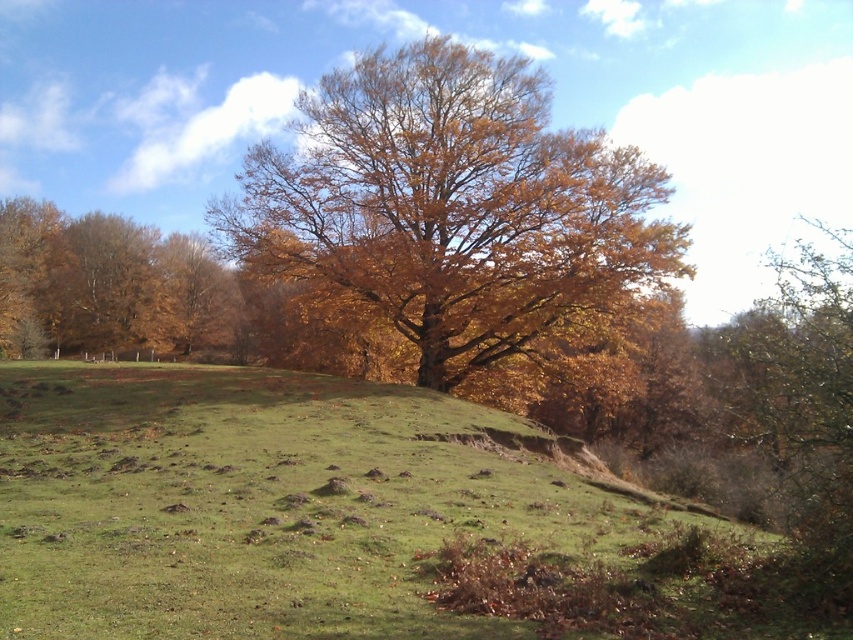
Looking at this image, between green grass at center and brown leafy tree at left, which one is positioned lower?

green grass at center is lower down.

Is green grass at center bigger than brown leafy tree at left?

Incorrect, green grass at center is not larger than brown leafy tree at left.

Who is more distant from viewer, [25,605] or [61,248]?

Answer: Positioned behind is point [61,248].

Image resolution: width=853 pixels, height=640 pixels. Identify the location of green grass at center. (265, 506).

Which of these two, green grass at center or golden-brown wood at center, stands shorter?

With less height is green grass at center.

What do you see at coordinates (265, 506) in the screenshot?
I see `green grass at center` at bounding box center [265, 506].

The width and height of the screenshot is (853, 640). I want to click on green grass at center, so click(265, 506).

Which is more to the left, golden-brown wood at center or brown leafy tree at left?

From the viewer's perspective, brown leafy tree at left appears more on the left side.

Between point (421, 120) and point (86, 349), which one is positioned behind?

The point (86, 349) is more distant.

Identify the location of golden-brown wood at center. (454, 209).